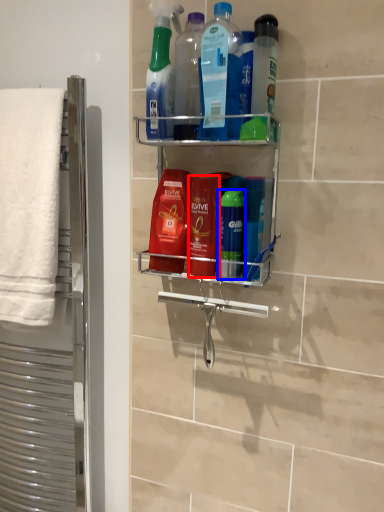
Question: Which of the following is the farthest to the observer, mouthwash (highlighted by a red box) or mouthwash (highlighted by a blue box)?

Choices:
 (A) mouthwash
 (B) mouthwash

Answer: (A)